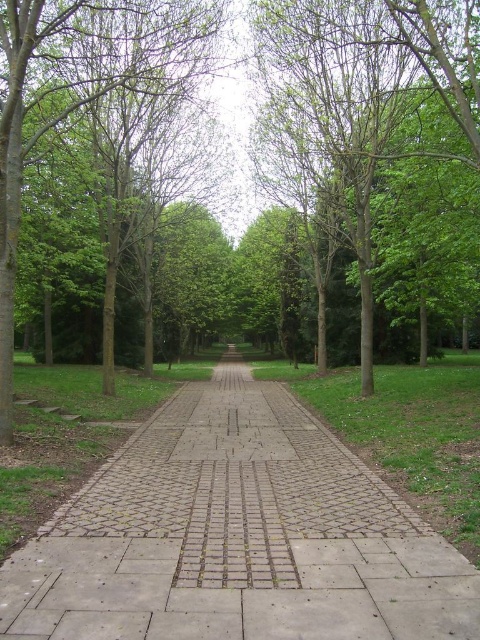
Question: Which is farther from the green grass at center?

Choices:
 (A) green leafy tree at center
 (B) green leafy tree at left
 (C) gray concrete pavement at center

Answer: (B)

Question: Can you confirm if gray concrete pavement at center is thinner than green leafy tree at left?

Choices:
 (A) yes
 (B) no

Answer: (A)

Question: Which point is farther to the camera?

Choices:
 (A) gray concrete pavement at center
 (B) green grass at center
 (C) green leafy tree at center
 (D) green leafy tree at left

Answer: (C)

Question: In this image, where is gray concrete pavement at center located relative to green grass at center?

Choices:
 (A) left
 (B) right

Answer: (A)

Question: Is gray concrete pavement at center above green leafy tree at center?

Choices:
 (A) yes
 (B) no

Answer: (B)

Question: Which point is closer to the camera?

Choices:
 (A) (32, 28)
 (B) (419, 465)
 (C) (176, 625)

Answer: (C)